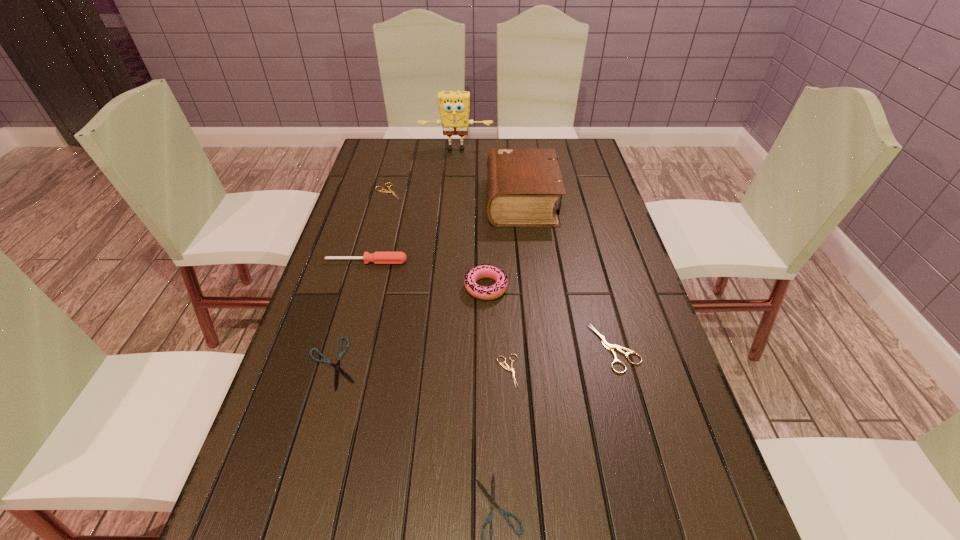
The width and height of the screenshot is (960, 540). Find the location of `the tallest object`. the tallest object is located at coordinates (454, 106).

Locate an element on the screen. The image size is (960, 540). sponge is located at coordinates (454, 106).

The height and width of the screenshot is (540, 960). I want to click on the eighth shortest object, so click(x=523, y=184).

Image resolution: width=960 pixels, height=540 pixels. I want to click on the third tallest object, so click(x=481, y=271).

I want to click on pink doughnut, so click(x=481, y=271).

Locate an element on the screen. Image resolution: width=960 pixels, height=540 pixels. the sixth shortest object is located at coordinates (377, 257).

Image resolution: width=960 pixels, height=540 pixels. In order to click on screwdriver in this screenshot , I will do `click(377, 257)`.

Image resolution: width=960 pixels, height=540 pixels. I want to click on the tallest shears, so click(x=608, y=346).

Find the location of a particular element. The width and height of the screenshot is (960, 540). the rightmost beige shears is located at coordinates (608, 346).

Locate an element on the screen. The image size is (960, 540). the farthest shears is located at coordinates (382, 190).